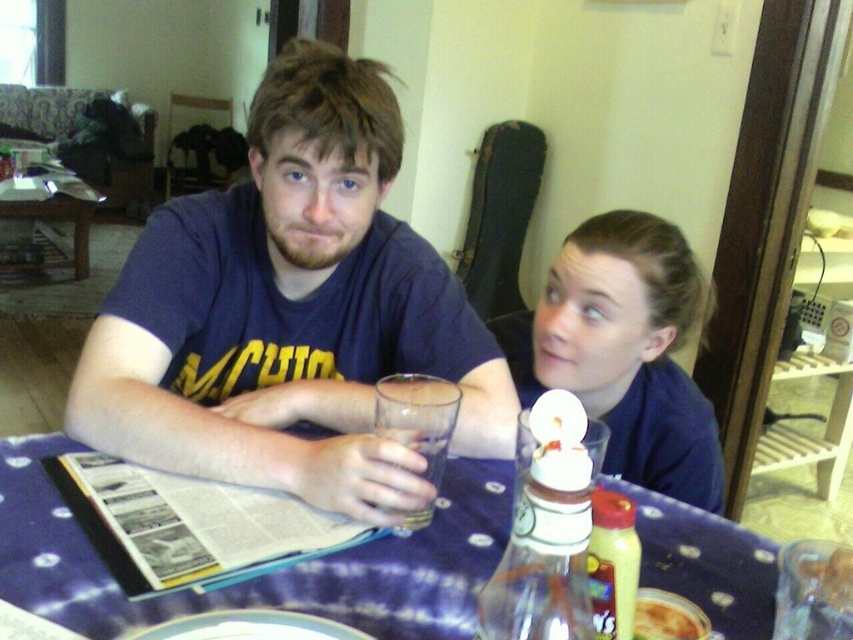
You are a delivery person who needs to place a small package on the table in the image. The table is located at coordinates point 0.900, 0.312. Can you confirm the exact location of the blue fabric table at center to ensure the package is delivered correctly?

The blue fabric table at center is located at point (265, 576), so the package should be placed there.

You are a furniture delivery person who needs to move a new table that is 6 feet long into the room. The new table has to be placed between the blue fabric table at center and the wooden table at left. Is there enough space between them to fit the new table?

The blue fabric table at center and wooden table at left are 12.03 feet apart, so yes, the new table that is 6 feet long can fit between them since the distance is greater than the table length.

You are a photographer standing in front of the wooden table at left and the yellowish matte pizza at lower center. Which object is closer to you?

The wooden table at left is closer to you since it is further to the viewer than the yellowish matte pizza at lower center.